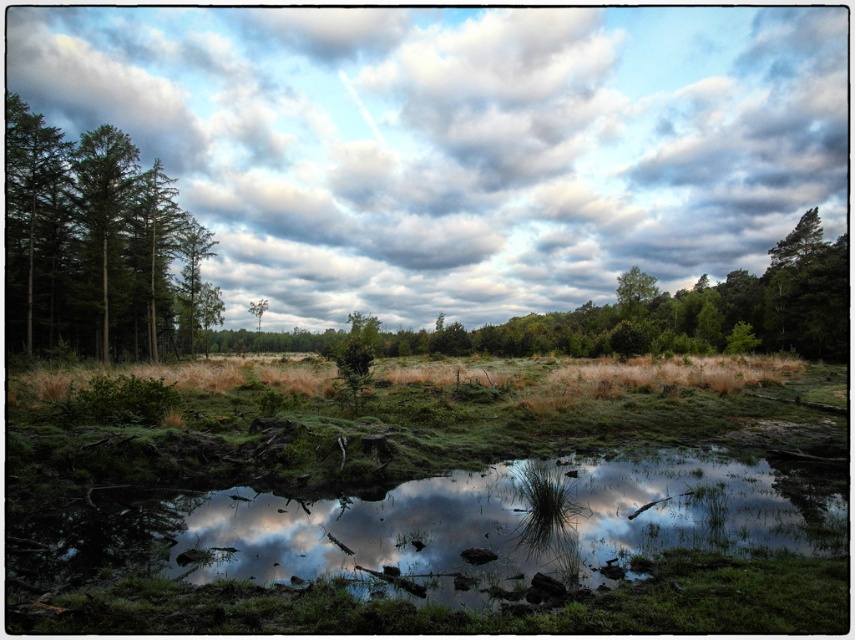
You are a bird flying over the serene natural landscape. You see the transparent water at center and the green leafy tree at upper center. Which object is located above the other?

The green leafy tree at upper center is located above the transparent water at center because the water is positioned under the tree.

You are a photographer standing at the edge of the pond. You want to capture a photo where both the transparent water at center and the green leafy tree at upper center are visible. Which object will occupy a larger portion of the photo?

The green leafy tree at upper center will occupy a larger portion of the photo because it is larger than the transparent water at center.

You are standing at the edge of the pond and want to locate the transparent water at center. According to the coordinates provided, in which direction should you look relative to your current position?

The transparent water at center is located at coordinates 0.831 on the x axis and 0.513 on the y axis. Since you are at the edge of the pond, which is likely near the lower part of the image, you should look towards the upper middle area to find the transparent water at center.